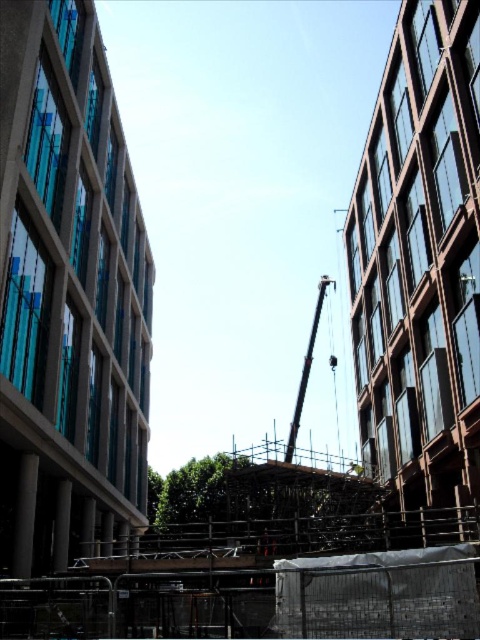
You are a construction worker standing at the edge of the construction site. You need to move a heavy beam from the ground to the upper floor of the building. The wooden scaffolding at center and the metallic gray crane at center are available. Which tool should you use to lift the beam safely?

The metallic gray crane at center should be used to lift the beam safely because the wooden scaffolding at center is positioned under it, and cranes are designed for heavy lifting operations.

You are a construction worker who needs to secure a safety net between the wooden scaffolding at center and the metallic gray crane at center. Which structure should you anchor the top of the safety net to ensure it reaches the highest point?

The wooden scaffolding at center is taller than the metallic gray crane at center, so you should anchor the top of the safety net to the wooden scaffolding at center to ensure it reaches the highest point.

You are a construction worker standing at the edge of the construction site. You need to move a heavy beam from the wooden scaffolding at center to the metallic gray crane at center. Since both are in your line of sight, which object would you have to reach first?

The wooden scaffolding at center is closer to the viewer than the metallic gray crane at center, so you would need to reach the wooden scaffolding at center first before moving towards the metallic gray crane at center.